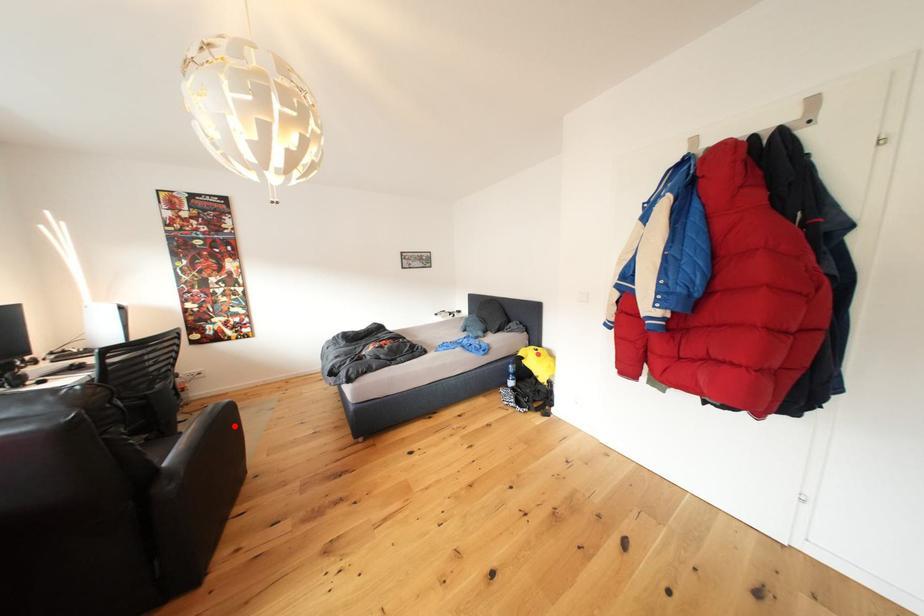
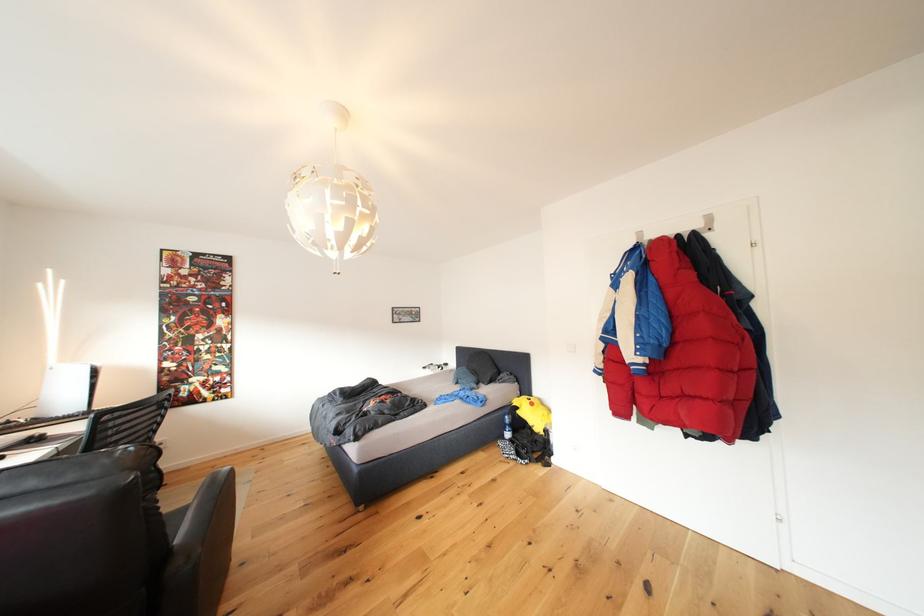
Question: I am providing you with two images of the same scene from different viewpoints. In image1, a red point is highlighted. Considering the same 3D point in image2, which of the following is correct?

Choices:
 (A) It is closer
 (B) It is farther

Answer: (B)